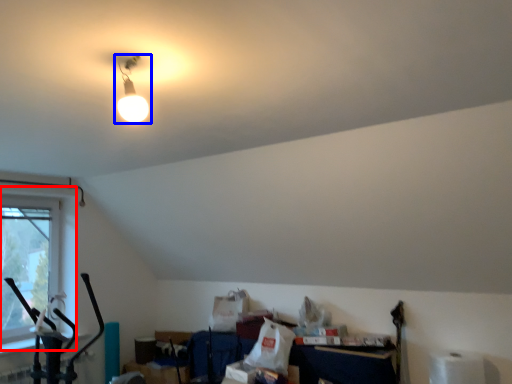
Question: Which of the following is the closest to the observer, window (highlighted by a red box) or lamp (highlighted by a blue box)?

Choices:
 (A) window
 (B) lamp

Answer: (B)